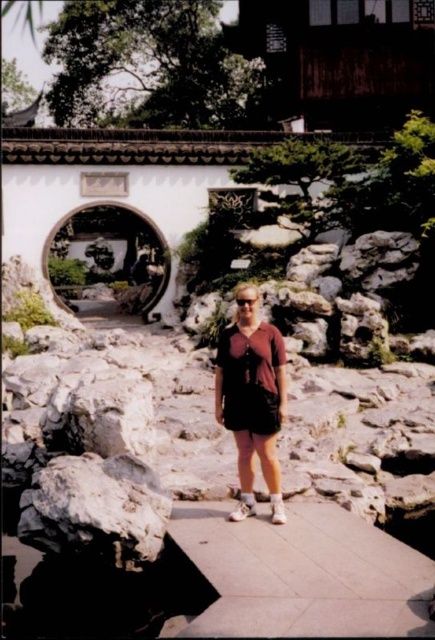
You are a photographer trying to capture the person in the scene. If you want to focus on the dark gray rough rock at center without including the matte brown shorts at center in the frame, which direction should you adjust your camera?

The dark gray rough rock at center is below the matte brown shorts at center. To focus on the dark gray rough rock at center without including the matte brown shorts at center, you should adjust your camera downward.

You are planning to walk along the smooth concrete path at center while wearing the matte brown shorts at center. Considering the length of the path and your shorts, will your shorts be long enough to cover your knees during the walk?

The smooth concrete path at center is shorter than matte brown shorts at center. Since the shorts are longer than the path, they will adequately cover your knees during the walk.